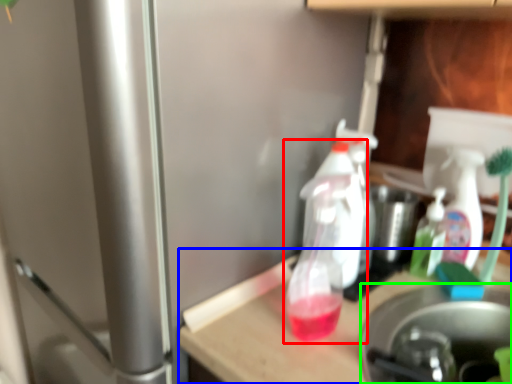
Question: Which is farther away from bottle (highlighted by a red box)? table (highlighted by a blue box) or appliance (highlighted by a green box)?

Choices:
 (A) table
 (B) appliance

Answer: (B)